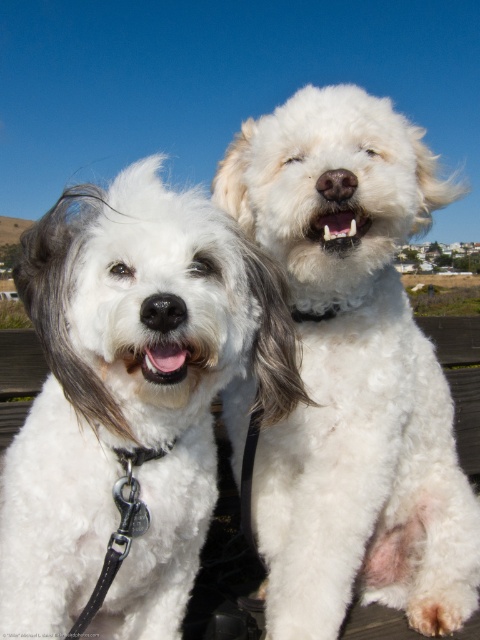
You are a dog owner who wants to buy matching harnesses for both dogs. The harness you found is designed for dogs weighing up to 15 kilograms. If the white fluffy dog at right weighs 14 kilograms, can the harness also fit the white fluffy dog at center?

The white fluffy dog at right is larger in size than the white fluffy dog at center. Since the larger dog weighs 14 kilograms and the harness is designed for up to 15 kilograms, the harness can fit both dogs as the smaller dog at center is likely lighter than 14 kilograms.

You are standing at the origin of the coordinate system in the image. You see two points, point (x=312, y=561) and point (x=83, y=237). Which point is closer to you?

Point (x=83, y=237) is closer to you because it is in front of point (x=312, y=561).